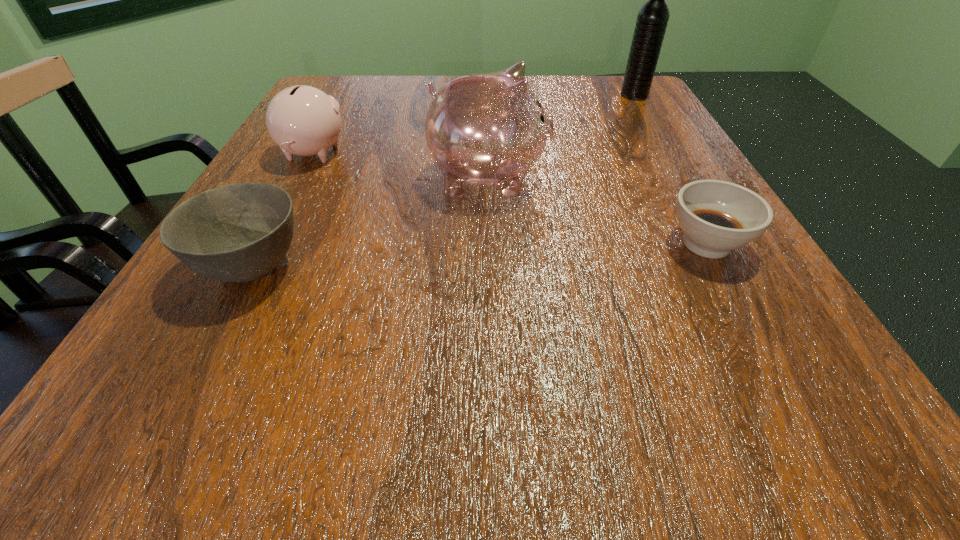
Image resolution: width=960 pixels, height=540 pixels. What are the coordinates of `the farthest object` in the screenshot? It's located at (652, 19).

The height and width of the screenshot is (540, 960). I want to click on the taller piggy bank, so click(488, 129).

Find the location of a particular element. This screenshot has height=540, width=960. the fourth shortest object is located at coordinates (488, 129).

Image resolution: width=960 pixels, height=540 pixels. Identify the location of the third shortest object. (302, 120).

Where is `the left piggy bank`? Image resolution: width=960 pixels, height=540 pixels. the left piggy bank is located at coordinates (302, 120).

Locate an element on the screen. This screenshot has height=540, width=960. the second shortest object is located at coordinates pyautogui.click(x=240, y=232).

This screenshot has height=540, width=960. In order to click on soup bowl in this screenshot , I will do `click(716, 217)`.

Where is `free space located on the front of the water bottle`? free space located on the front of the water bottle is located at coordinates (659, 137).

At what (x,y) coordinates should I click in order to perform the action: click on vacant space located 0.120m on the front facing side of the third object from left to right. Please return your answer as a coordinate pair (x, y). This screenshot has height=540, width=960. Looking at the image, I should click on (614, 178).

Locate an element on the screen. The height and width of the screenshot is (540, 960). free space located on the right of the shorter piggy bank is located at coordinates click(x=477, y=154).